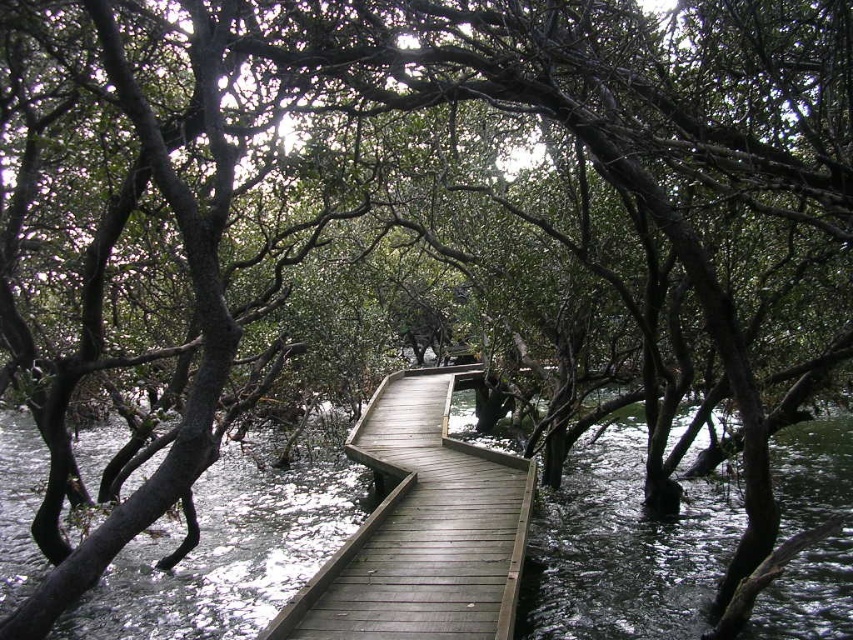
You are standing on the wooden boardwalk in the mangrove forest. You notice a point marked at coordinates (425, 532). What color is the wood at that point?

The wood at point (425, 532) is greenish brown.